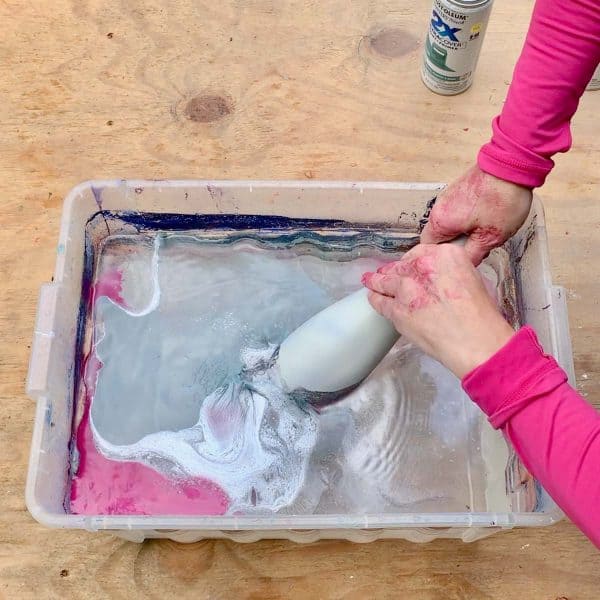
You are a GUI agent. You are given a task and a screenshot of the screen. Output one action in this format:
    pyautogui.click(x=<x>, y=<y>)
    Task: Click on the table
    
    Given the screenshot: What is the action you would take?
    pyautogui.click(x=247, y=91)